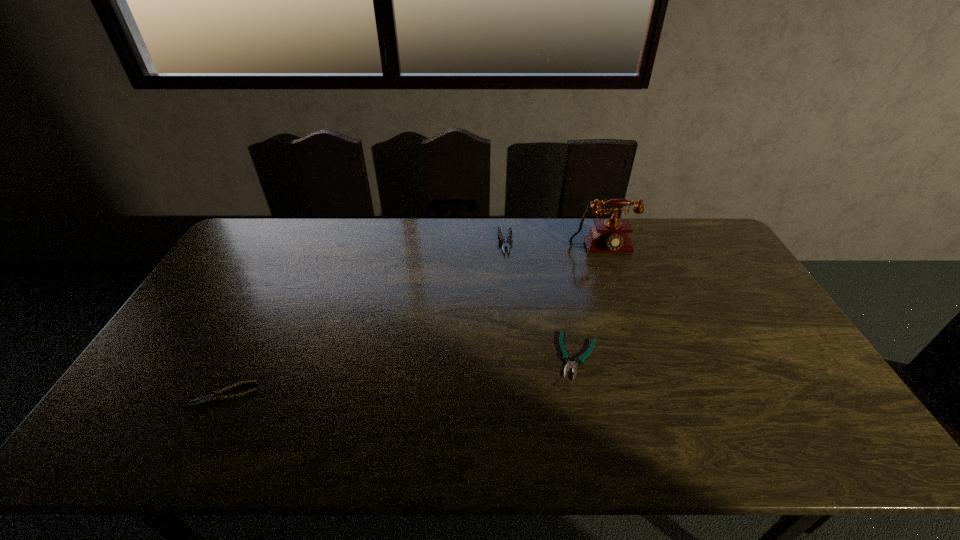
Find the location of `free area in between the tallest pliers and the tallest object`. free area in between the tallest pliers and the tallest object is located at coordinates (554, 246).

Where is `vacant area that lies between the tallest object and the second nearest object`? vacant area that lies between the tallest object and the second nearest object is located at coordinates (590, 303).

The image size is (960, 540). I want to click on empty space that is in between the tallest pliers and the third farthest object, so click(x=542, y=299).

Locate an element on the screen. This screenshot has height=540, width=960. free spot between the tallest object and the nearest object is located at coordinates click(414, 322).

The image size is (960, 540). Find the location of `free space between the leftmost pliers and the third farthest object`. free space between the leftmost pliers and the third farthest object is located at coordinates (402, 375).

Where is `vacant space in between the tallest pliers and the tallest object`? This screenshot has height=540, width=960. vacant space in between the tallest pliers and the tallest object is located at coordinates (554, 246).

What are the coordinates of `vacant area that lies between the tallest object and the third object from right to left` in the screenshot? It's located at (554, 246).

You are a GUI agent. You are given a task and a screenshot of the screen. Output one action in this format:
    pyautogui.click(x=<x>, y=<y>)
    Task: Click on the empty space between the nearest pliers and the second nearest pliers
    
    Given the screenshot: What is the action you would take?
    pyautogui.click(x=402, y=375)

You are a GUI agent. You are given a task and a screenshot of the screen. Output one action in this format:
    pyautogui.click(x=<x>, y=<y>)
    Task: Click on the empty location between the second tallest object and the telephone
    
    Given the screenshot: What is the action you would take?
    pyautogui.click(x=554, y=246)

Locate an element on the screen. The image size is (960, 540). free space that is in between the third farthest object and the second tallest object is located at coordinates (542, 299).